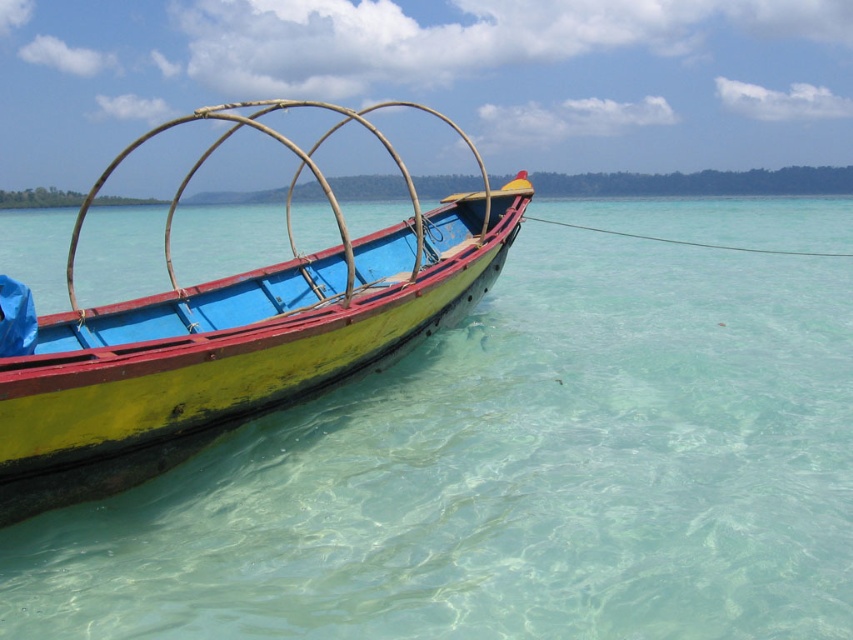
You are a passenger on the yellow matte boat at center and want to jump into the water. Which direction should you move to reach the clear water at boat left?

The clear water at boat left is positioned under the yellow matte boat at center, so you can jump directly to the left side of the boat to reach the clear water at boat left.

You are a swimmer who wants to reach the yellow matte boat at center from the clear water at boat left. Given that you can swim at a speed of 1.2 meters per second, how many seconds will it take you to reach the boat?

The distance between the clear water at boat left and the yellow matte boat at center is 8.44 meters. Swimming at 1.2 meters per second, it would take approximately 7.03 seconds to reach the boat.